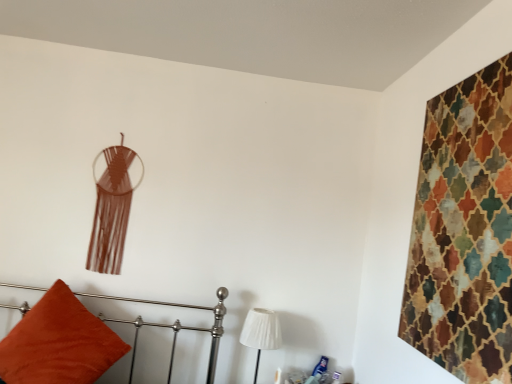
The height and width of the screenshot is (384, 512). What do you see at coordinates (261, 332) in the screenshot?
I see `white pleated fabric at lower center` at bounding box center [261, 332].

Locate an element on the screen. The width and height of the screenshot is (512, 384). white pleated fabric at lower center is located at coordinates (261, 332).

What is the approximate height of textured multicolored tapestry at upper right?

36.08 inches.

Locate an element on the screen. This screenshot has height=384, width=512. textured multicolored tapestry at upper right is located at coordinates (464, 231).

This screenshot has width=512, height=384. What are the coordinates of `velvet orange pillow at lower left` in the screenshot? It's located at (176, 324).

Does textured multicolored tapestry at upper right have a larger size compared to velvet orange pillow at lower left?

No, textured multicolored tapestry at upper right is not bigger than velvet orange pillow at lower left.

Considering the relative sizes of textured multicolored tapestry at upper right and velvet orange pillow at lower left in the image provided, is textured multicolored tapestry at upper right shorter than velvet orange pillow at lower left?

No, textured multicolored tapestry at upper right is not shorter than velvet orange pillow at lower left.

Can you confirm if textured multicolored tapestry at upper right is positioned to the right of velvet orange pillow at lower left?

Yes.

Which is nearer, (445, 156) or (214, 333)?

Point (445, 156) appears to be closer to the viewer than point (214, 333).

Do you think velvet orange pillow at lower left is within white pleated fabric at lower center, or outside of it?

velvet orange pillow at lower left cannot be found inside white pleated fabric at lower center.

How distant is velvet orange pillow at lower left from white pleated fabric at lower center?

12.50 inches.

Between velvet orange pillow at lower left and white pleated fabric at lower center, which one has smaller size?

white pleated fabric at lower center.

Considering the relative sizes of velvet orange pillow at lower left and white pleated fabric at lower center in the image provided, is velvet orange pillow at lower left wider than white pleated fabric at lower center?

Indeed, velvet orange pillow at lower left has a greater width compared to white pleated fabric at lower center.

Is white pleated fabric at lower center completely or partially outside of textured multicolored tapestry at upper right?

Absolutely, white pleated fabric at lower center is external to textured multicolored tapestry at upper right.

From the picture: In terms of width, does white pleated fabric at lower center look wider or thinner when compared to textured multicolored tapestry at upper right?

Considering their sizes, white pleated fabric at lower center looks broader than textured multicolored tapestry at upper right.

Is white pleated fabric at lower center positioned with its back to textured multicolored tapestry at upper right?

No, white pleated fabric at lower center is not facing the opposite direction of textured multicolored tapestry at upper right.

Is white pleated fabric at lower center to the right of textured multicolored tapestry at upper right from the viewer's perspective?

No.

Which point is more forward, [438,333] or [275,348]?

Positioned in front is point [438,333].

From the image's perspective, is textured multicolored tapestry at upper right below white pleated fabric at lower center?

Incorrect, from the image's perspective, textured multicolored tapestry at upper right is higher than white pleated fabric at lower center.

Between textured multicolored tapestry at upper right and white pleated fabric at lower center, which one has less height?

white pleated fabric at lower center.

Is velvet orange pillow at lower left oriented away from textured multicolored tapestry at upper right?

No, textured multicolored tapestry at upper right is not at the back of velvet orange pillow at lower left.

Can you confirm if velvet orange pillow at lower left is bigger than textured multicolored tapestry at upper right?

Yes.

Is velvet orange pillow at lower left positioned in front of textured multicolored tapestry at upper right?

No, velvet orange pillow at lower left is further to the viewer.

Between white pleated fabric at lower center and velvet orange pillow at lower left, which one is positioned in front?

Positioned in front is velvet orange pillow at lower left.

Considering the sizes of objects white pleated fabric at lower center and velvet orange pillow at lower left in the image provided, who is thinner, white pleated fabric at lower center or velvet orange pillow at lower left?

white pleated fabric at lower center.

Between white pleated fabric at lower center and velvet orange pillow at lower left, which one has more height?

With more height is velvet orange pillow at lower left.

At what (x,y) coordinates should I click in order to perform the action: click on furniture below the white pleated fabric at lower center (from a real-world perspective). Please return your answer as a coordinate pair (x, y). Looking at the image, I should click on (176, 324).

Where is `furniture lying on the left of textured multicolored tapestry at upper right`? The height and width of the screenshot is (384, 512). furniture lying on the left of textured multicolored tapestry at upper right is located at coordinates (176, 324).

Locate an element on the screen. furniture in front of the white pleated fabric at lower center is located at coordinates (176, 324).

When comparing their distances from white pleated fabric at lower center, does textured multicolored tapestry at upper right or velvet orange pillow at lower left seem closer?

The object closer to white pleated fabric at lower center is velvet orange pillow at lower left.

Looking at the image, which one is located closer to textured multicolored tapestry at upper right, velvet orange pillow at lower left or white pleated fabric at lower center?

white pleated fabric at lower center is closer to textured multicolored tapestry at upper right.

Considering their positions, is white pleated fabric at lower center positioned further to velvet orange pillow at lower left than textured multicolored tapestry at upper right?

textured multicolored tapestry at upper right lies further to velvet orange pillow at lower left than the other object.

Looking at the image, which one is located closer to velvet orange pillow at lower left, textured multicolored tapestry at upper right or white pleated fabric at lower center?

white pleated fabric at lower center is closer to velvet orange pillow at lower left.

Which object lies nearer to the anchor point textured multicolored tapestry at upper right, white pleated fabric at lower center or velvet orange pillow at lower left?

Among the two, white pleated fabric at lower center is located nearer to textured multicolored tapestry at upper right.

Considering their positions, is velvet orange pillow at lower left positioned further to white pleated fabric at lower center than textured multicolored tapestry at upper right?

textured multicolored tapestry at upper right is positioned further to the anchor white pleated fabric at lower center.

Where is `table lamp located between velvet orange pillow at lower left and textured multicolored tapestry at upper right in the left-right direction`? This screenshot has height=384, width=512. table lamp located between velvet orange pillow at lower left and textured multicolored tapestry at upper right in the left-right direction is located at coordinates (261, 332).